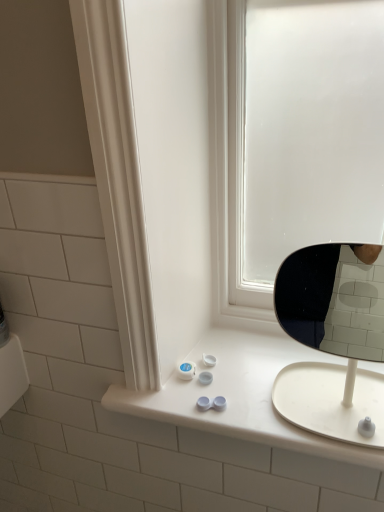
What is the approximate height of white plastic counter top at center?

2.07 inches.

This screenshot has width=384, height=512. Find the location of `white plastic counter top at center`. white plastic counter top at center is located at coordinates (240, 394).

This screenshot has height=512, width=384. Describe the element at coordinates (240, 394) in the screenshot. I see `white plastic counter top at center` at that location.

I want to click on white plastic counter top at center, so tap(240, 394).